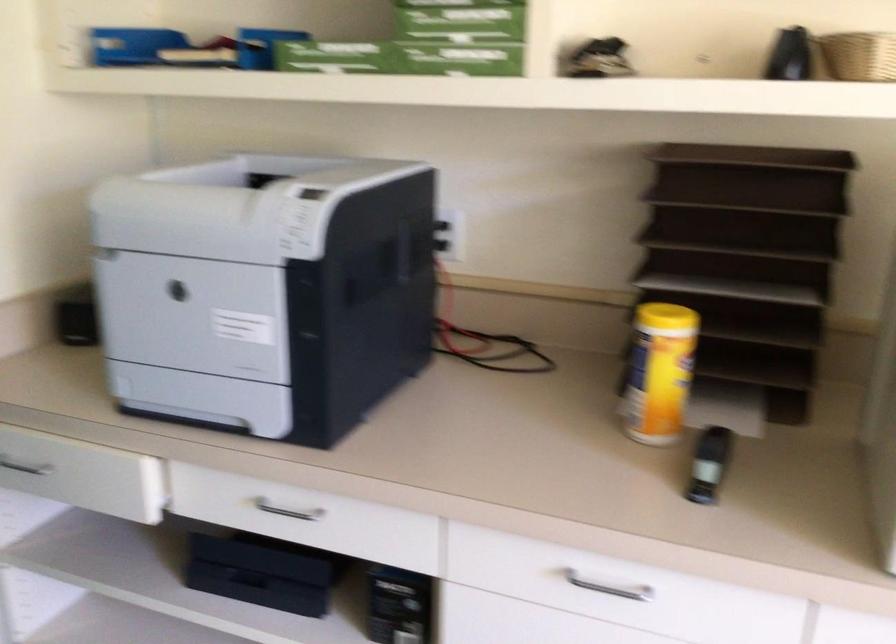
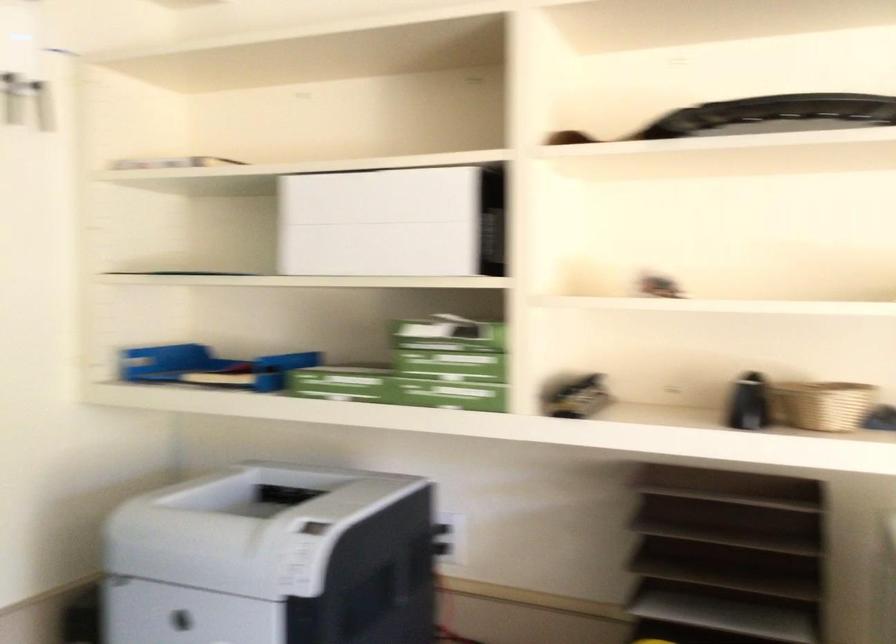
Based on the photo, which direction would the cameraman need to move to produce the second image?

The movement direction of the cameraman is right, backward.